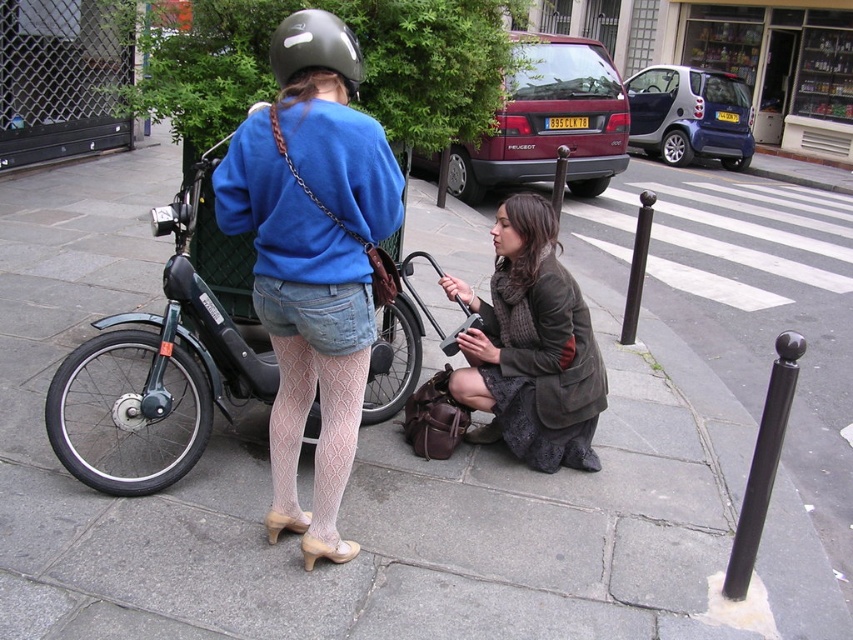
In the scene shown: Can you confirm if black matte bicycle at center is thinner than dark brown leather jacket at lower center?

In fact, black matte bicycle at center might be wider than dark brown leather jacket at lower center.

Does black matte bicycle at center have a larger size compared to dark brown leather jacket at lower center?

Correct, black matte bicycle at center is larger in size than dark brown leather jacket at lower center.

Locate an element on the screen. black matte bicycle at center is located at coordinates (166, 358).

Does point (341, 449) come closer to viewer compared to point (548, 408)?

Yes.

Locate an element on the screen. The width and height of the screenshot is (853, 640). matte blue sweater at center is located at coordinates (312, 257).

Is point (345, 193) in front of point (560, 282)?

Yes, it is.

Locate an element on the screen. matte blue sweater at center is located at coordinates (312, 257).

Does matte blue sweater at center lie in front of matte black helmet at upper center?

Yes, matte blue sweater at center is in front of matte black helmet at upper center.

Which is in front, point (345, 77) or point (328, 28)?

Point (328, 28) is more forward.

Locate an element on the screen. Image resolution: width=853 pixels, height=640 pixels. matte blue sweater at center is located at coordinates (312, 257).

You are a GUI agent. You are given a task and a screenshot of the screen. Output one action in this format:
    pyautogui.click(x=<x>, y=<y>)
    Task: Click on the matte blue sweater at center
    The width and height of the screenshot is (853, 640).
    Given the screenshot: What is the action you would take?
    pyautogui.click(x=312, y=257)